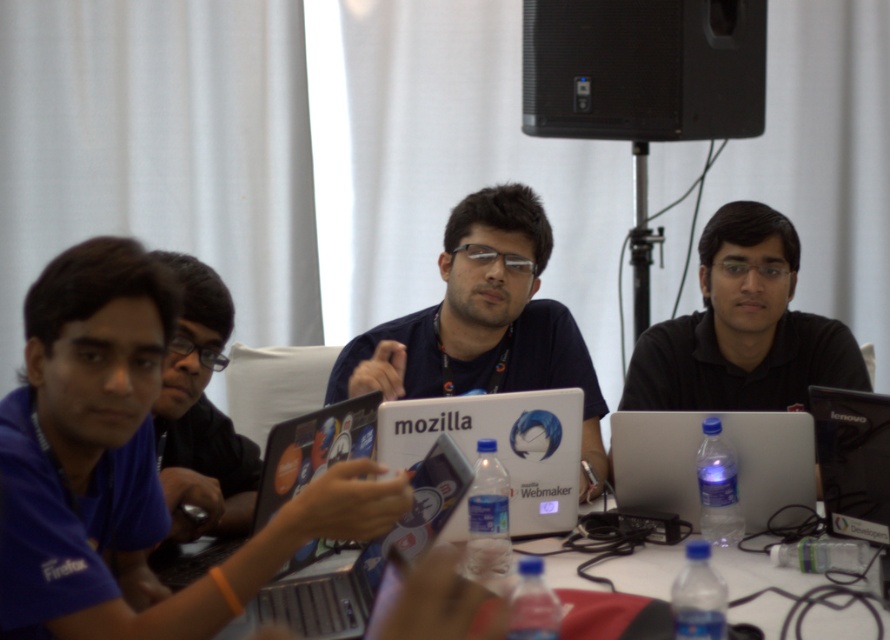
You are organizing a tech workshop and need to ensure that all laptops fit on the table. The table has a maximum capacity of 1.2 meters in length. You have two laptops, the matte silver laptop at center and the sleek silver laptop at center. Which laptop would require more space on the table?

The matte silver laptop at center is larger in size than the sleek silver laptop at center, so it would require more space on the table.

You are standing in the room and see the blue fabric shirt at left. Can you estimate its location using coordinates?

The blue fabric shirt at left is located at coordinates point (123,467).